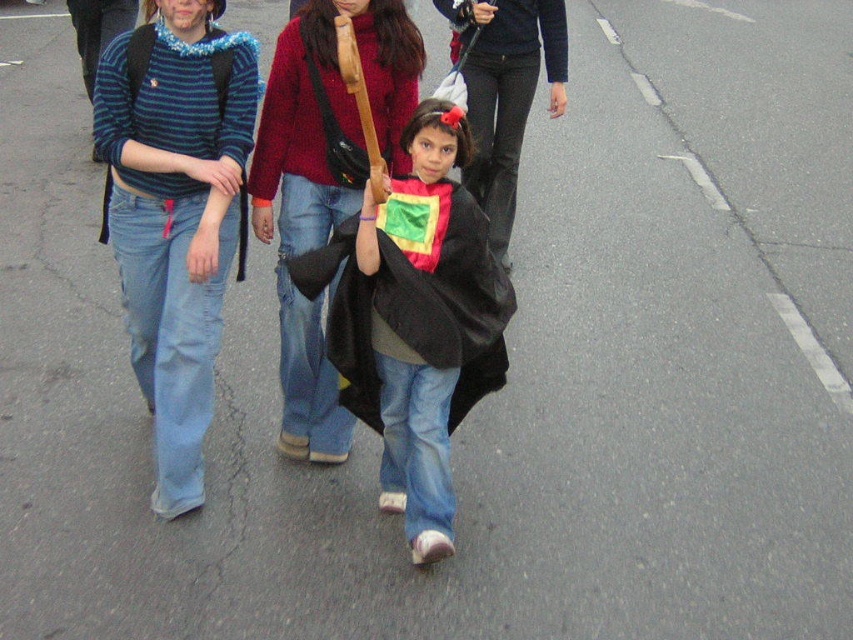
You are a photographer standing at the scene. You want to take a closeup photo of the striped knit sweater at left without moving any people. Can you do that?

The striped knit sweater at left is 3.61 meters away from the viewer. Since it is within a reasonable distance for a photographer to take a closeup photo without moving anyone, yes, you can take the photo.